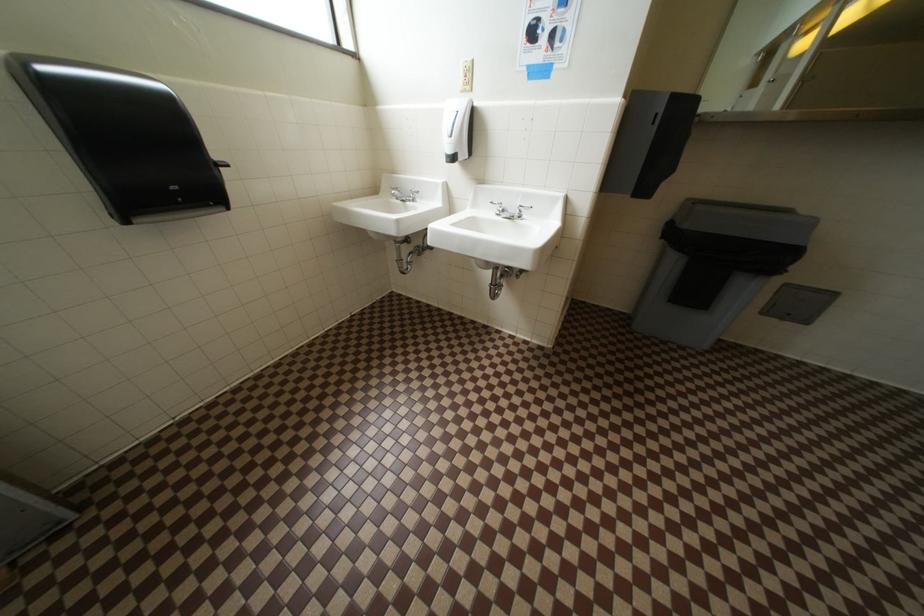
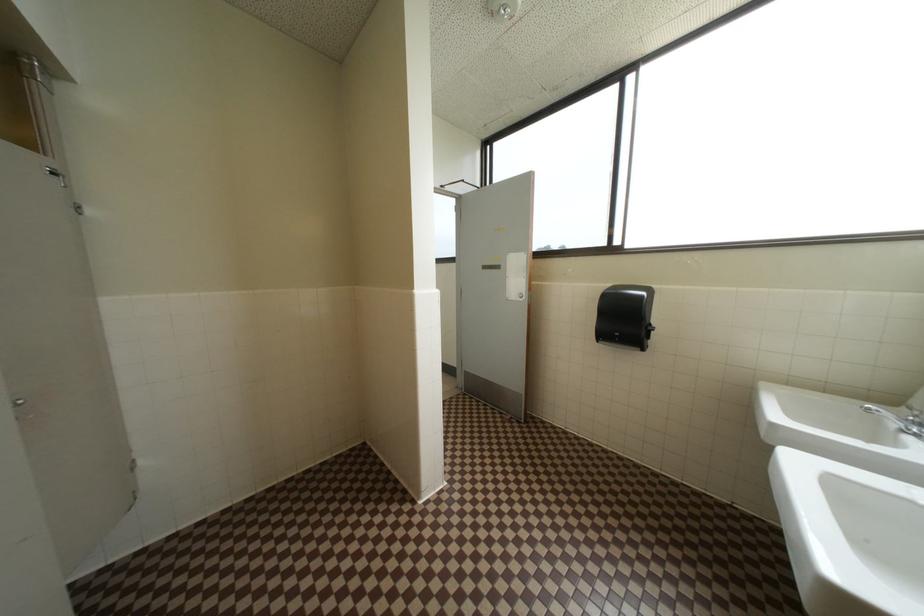
Question: The camera is either moving clockwise (left) or counter-clockwise (right) around the object. The first image is from the beginning of the video and the second image is from the end. Is the camera moving left or right when shooting the video?

Choices:
 (A) Left
 (B) Right

Answer: (B)